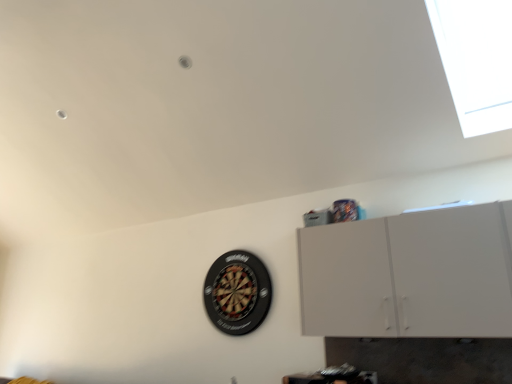
Question: Considering the relative sizes of black plastic dartboard at center and transparent glass window at upper right in the image provided, is black plastic dartboard at center thinner than transparent glass window at upper right?

Choices:
 (A) no
 (B) yes

Answer: (B)

Question: From the image's perspective, is black plastic dartboard at center above transparent glass window at upper right?

Choices:
 (A) no
 (B) yes

Answer: (A)

Question: Is black plastic dartboard at center positioned far away from transparent glass window at upper right?

Choices:
 (A) yes
 (B) no

Answer: (A)

Question: Can you confirm if black plastic dartboard at center is taller than transparent glass window at upper right?

Choices:
 (A) yes
 (B) no

Answer: (B)

Question: Considering the relative positions of black plastic dartboard at center and transparent glass window at upper right in the image provided, is black plastic dartboard at center to the right of transparent glass window at upper right from the viewer's perspective?

Choices:
 (A) no
 (B) yes

Answer: (A)

Question: Choose the correct answer: Is transparent glass window at upper right inside white matte cabinet at upper right or outside it?

Choices:
 (A) inside
 (B) outside

Answer: (B)

Question: From a real-world perspective, is transparent glass window at upper right physically located above or below white matte cabinet at upper right?

Choices:
 (A) above
 (B) below

Answer: (A)

Question: Is point (507, 52) closer or farther from the camera than point (482, 278)?

Choices:
 (A) closer
 (B) farther

Answer: (B)

Question: Relative to white matte cabinet at upper right, is transparent glass window at upper right in front or behind?

Choices:
 (A) front
 (B) behind

Answer: (A)

Question: Is white matte cabinet at upper right to the left or to the right of transparent glass window at upper right in the image?

Choices:
 (A) left
 (B) right

Answer: (A)

Question: From the image's perspective, is white matte cabinet at upper right located above or below transparent glass window at upper right?

Choices:
 (A) below
 (B) above

Answer: (A)

Question: From a real-world perspective, relative to transparent glass window at upper right, is white matte cabinet at upper right vertically above or below?

Choices:
 (A) below
 (B) above

Answer: (A)

Question: Relative to transparent glass window at upper right, is white matte cabinet at upper right in front or behind?

Choices:
 (A) front
 (B) behind

Answer: (B)

Question: From the image's perspective, is black plastic dartboard at center above or below transparent glass window at upper right?

Choices:
 (A) below
 (B) above

Answer: (A)

Question: Is black plastic dartboard at center situated inside transparent glass window at upper right or outside?

Choices:
 (A) outside
 (B) inside

Answer: (A)